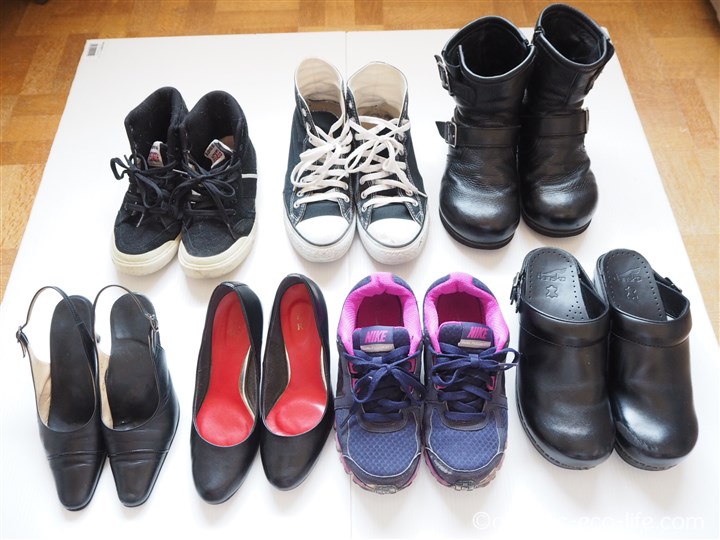
Image resolution: width=720 pixels, height=540 pixels. Identify the location of bottom row of shoes. [81, 383], [137, 386], [222, 383], [292, 375], [378, 383], [463, 387], [569, 370], [634, 367].